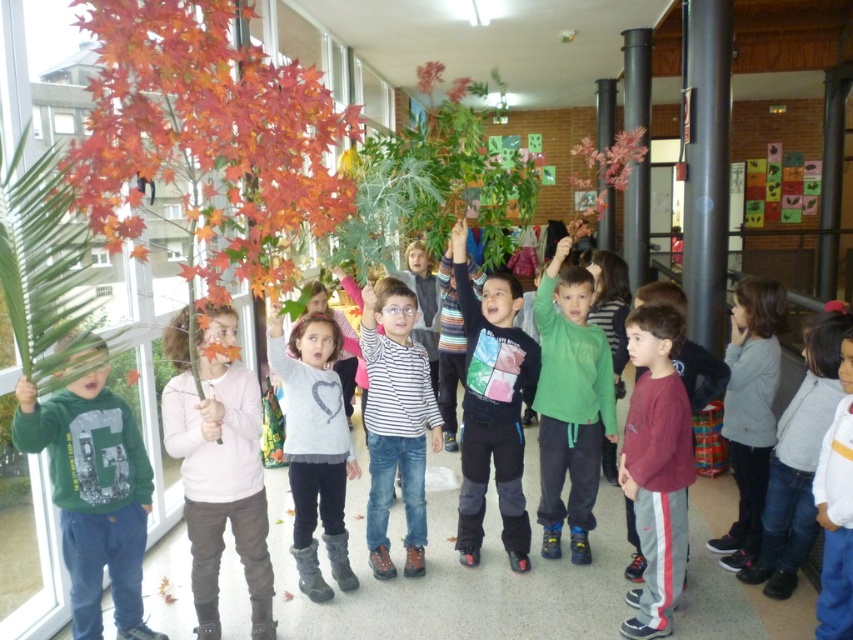
Does green matte sweater at left come in front of pink fabric shirt at center?

Yes, green matte sweater at left is closer to the viewer.

Looking at this image, which is more to the right, green matte sweater at left or pink fabric shirt at center?

From the viewer's perspective, pink fabric shirt at center appears more on the right side.

The image size is (853, 640). What do you see at coordinates (93, 493) in the screenshot? I see `green matte sweater at left` at bounding box center [93, 493].

Where is `green matte sweater at left`? The width and height of the screenshot is (853, 640). green matte sweater at left is located at coordinates (93, 493).

Is point (347, 477) in front of point (643, 131)?

Yes, it is.

From the picture: Does white fuzzy sweater at center have a lesser width compared to matte red maple leaf at upper right?

Indeed, white fuzzy sweater at center has a lesser width compared to matte red maple leaf at upper right.

Is point (334, 524) less distant than point (606, 209)?

That is True.

Where is `white fuzzy sweater at center`? The image size is (853, 640). white fuzzy sweater at center is located at coordinates (314, 445).

Does green matte shirt at center have a greater height compared to multicolored striped sweater at center?

No.

Who is lower down, green matte shirt at center or multicolored striped sweater at center?

multicolored striped sweater at center is lower down.

Where is `green matte shirt at center`? The image size is (853, 640). green matte shirt at center is located at coordinates (570, 403).